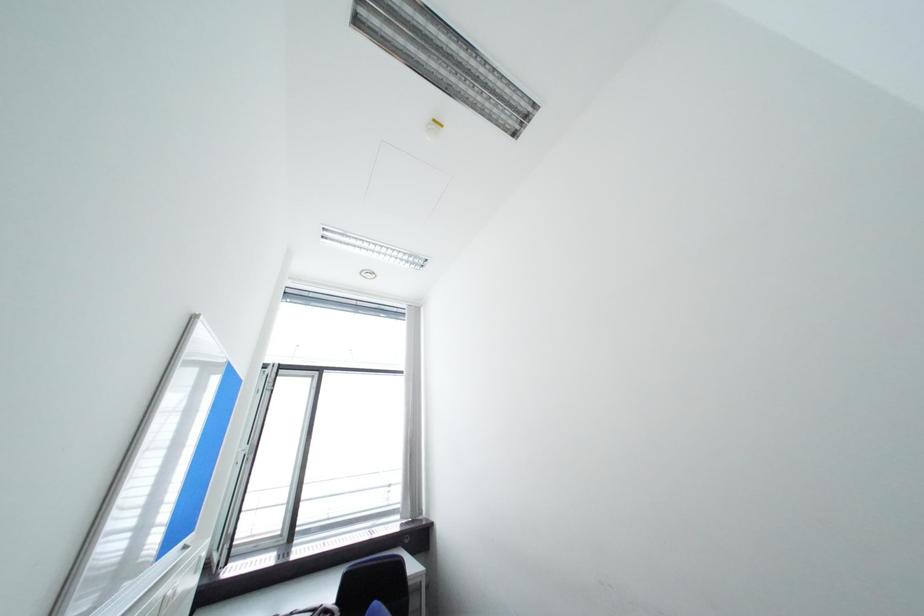
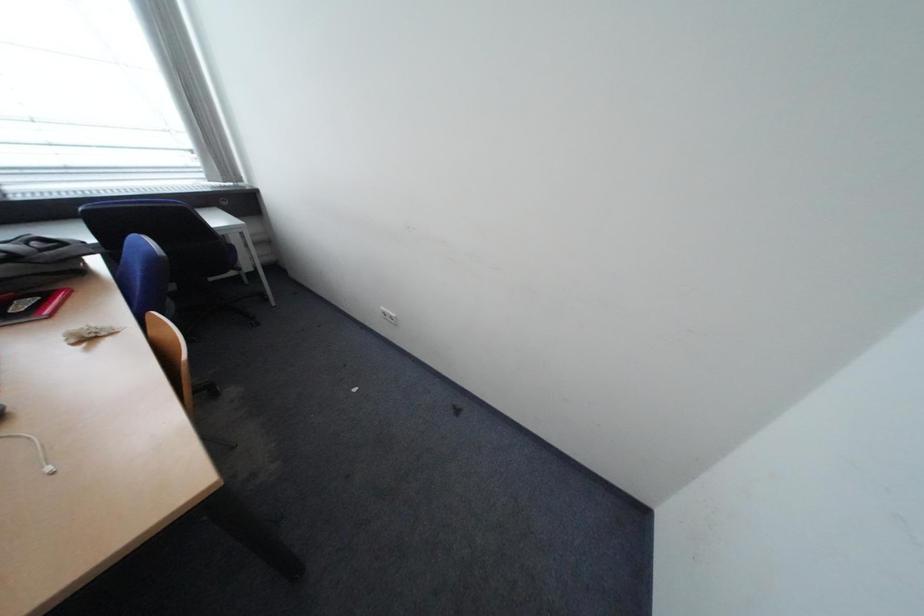
First-person continuous shooting, in which direction is the camera rotating?

The camera rotated toward right-down.